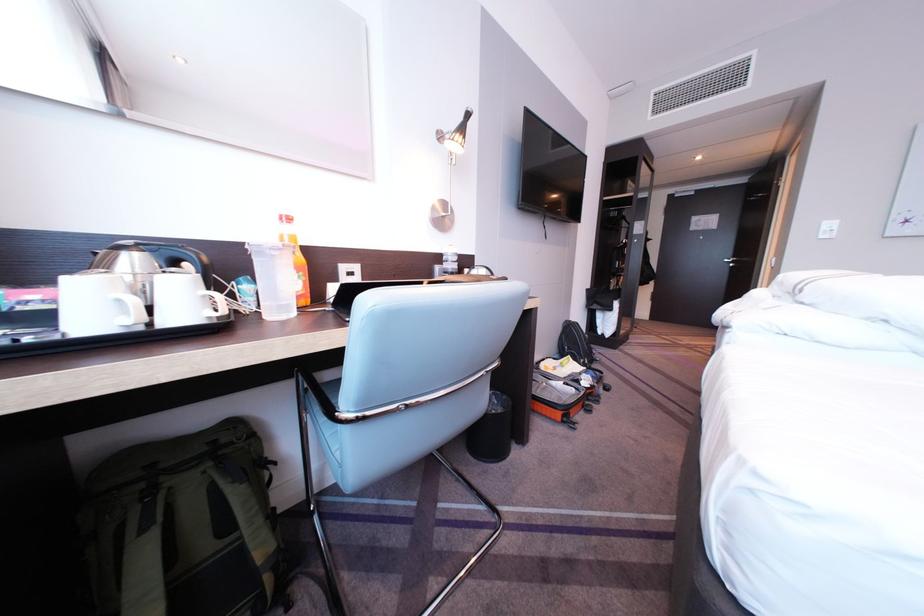
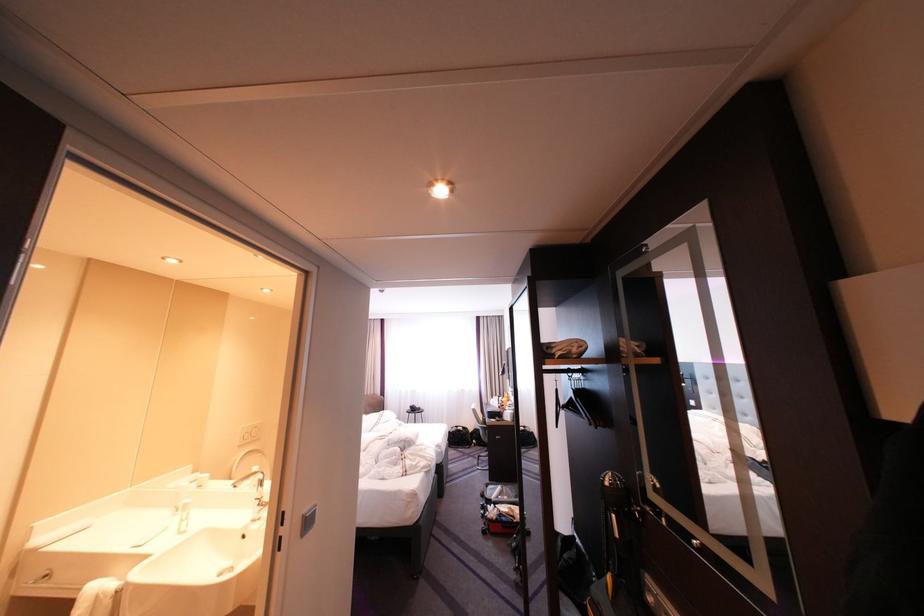
Question: I am providing you with two images of the same scene from different viewpoints. Please identify which objects are invisible in image2.

Choices:
 (A) orange plastic bottle
 (B) open red suitcase
 (C) chrome faucet handle
 (D) stacked paper items

Answer: (A)